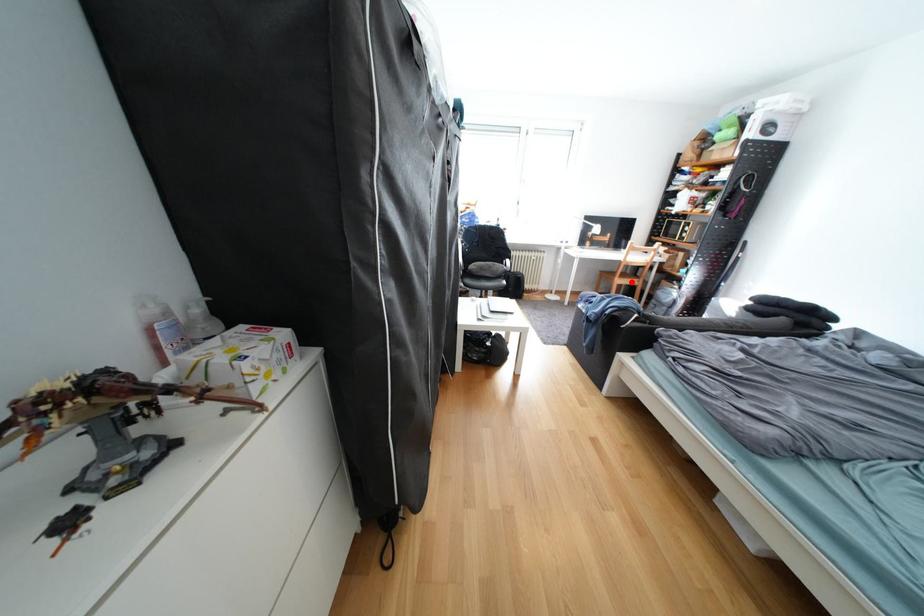
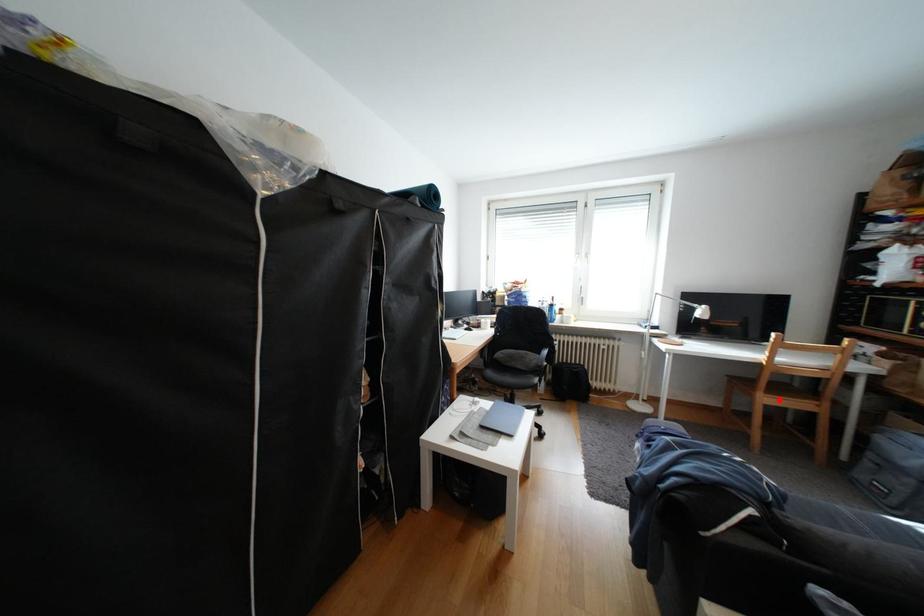
I am providing you with two images of the same scene from different viewpoints. A red point is marked on the first image and another point is marked on the second image. Is the red point in image1 aligned with the point shown in image2?

Yes